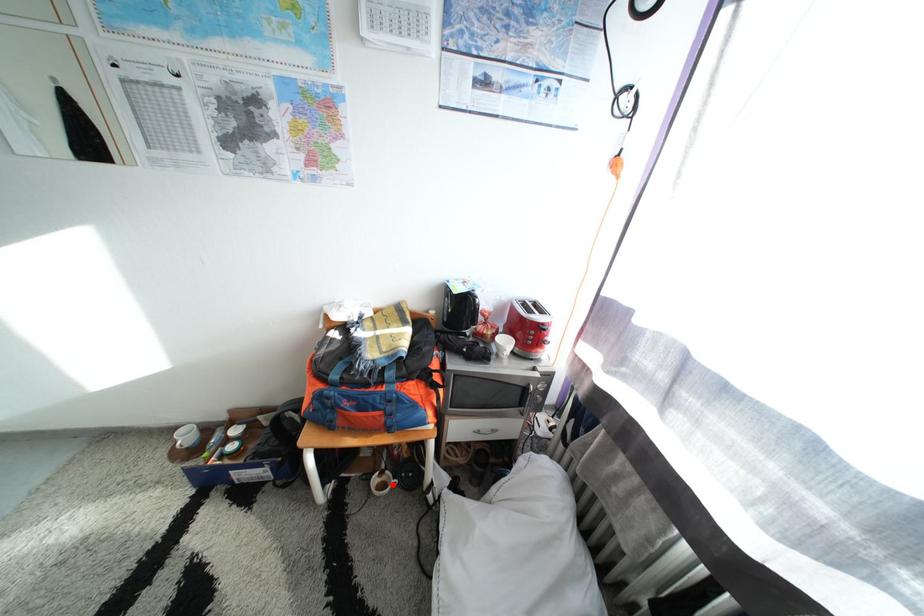
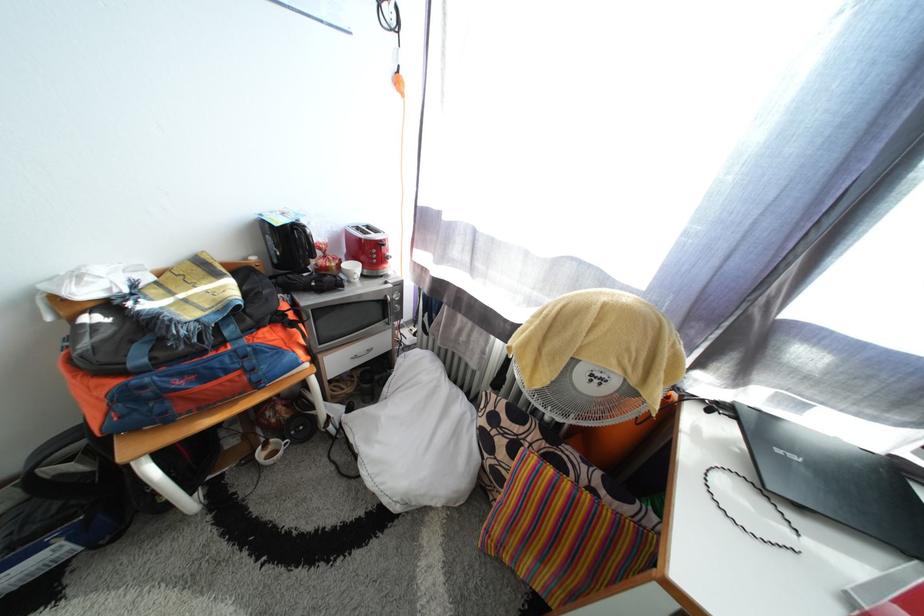
Question: I am providing you with two images of the same scene from different viewpoints. In image1, a red point is highlighted. Considering the same 3D point in image2, which of the following is correct?

Choices:
 (A) It is closer
 (B) It is farther

Answer: (A)